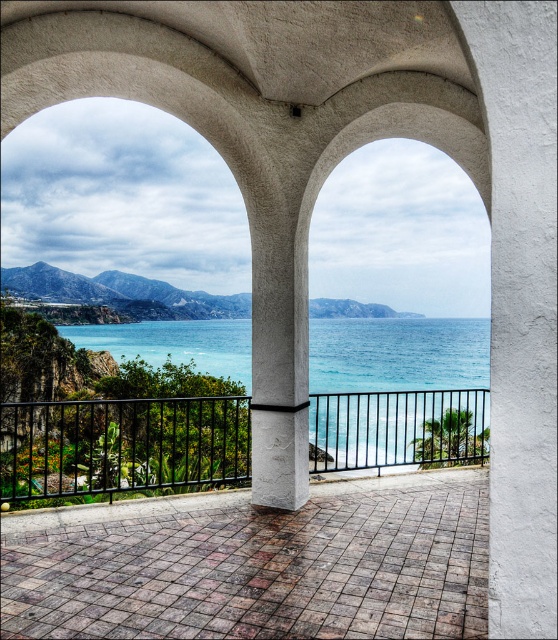
Is black metal/rail at center smaller than blue water at center?

Incorrect, black metal/rail at center is not smaller in size than blue water at center.

Describe the element at coordinates (122, 445) in the screenshot. This screenshot has height=640, width=558. I see `black metal/rail at center` at that location.

Locate an element on the screen. This screenshot has height=640, width=558. black metal/rail at center is located at coordinates (122, 445).

Image resolution: width=558 pixels, height=640 pixels. What are the coordinates of `black metal/rail at center` in the screenshot? It's located at (122, 445).

Does white stucco pillar at center lie behind black metal/rail at center?

No, it is in front of black metal/rail at center.

Can you confirm if white stucco pillar at center is thinner than black metal/rail at center?

Indeed, white stucco pillar at center has a lesser width compared to black metal/rail at center.

Is point (511, 512) positioned before point (475, 458)?

Yes, it is in front of point (475, 458).

This screenshot has height=640, width=558. What are the coordinates of `white stucco pillar at center` in the screenshot? It's located at (519, 301).

Can you confirm if white stucco pillar at center is smaller than blue water at center?

Correct, white stucco pillar at center occupies less space than blue water at center.

Between point (499, 312) and point (315, 348), which one is positioned in front?

Point (499, 312) is in front.

Locate an element on the screen. The width and height of the screenshot is (558, 640). white stucco pillar at center is located at coordinates (519, 301).